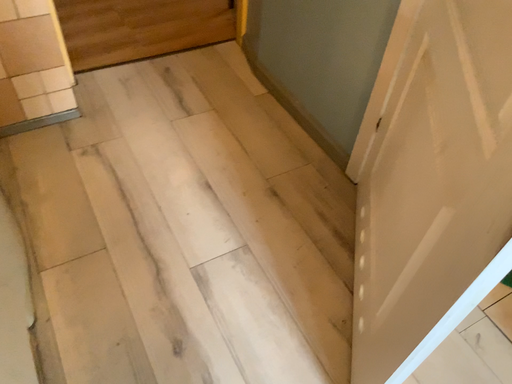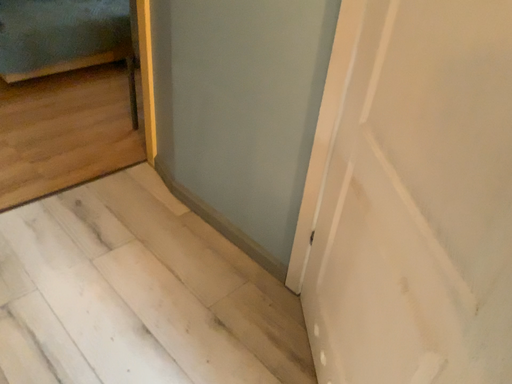
Question: How did the camera likely rotate when shooting the video?

Choices:
 (A) rotated downward
 (B) rotated upward

Answer: (B)